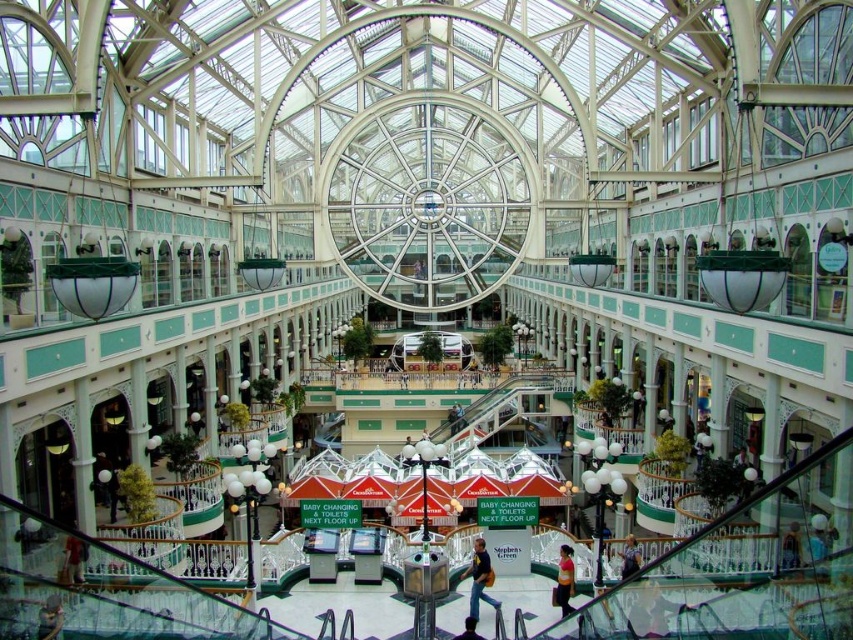
Who is taller, jeans at center or blue denim jeans at lower center?

jeans at center

Which is in front, point (476, 605) or point (630, 534)?

Point (476, 605) is in front.

Who is more distant from viewer, (479, 544) or (628, 557)?

Positioned behind is point (628, 557).

Locate an element on the screen. The height and width of the screenshot is (640, 853). jeans at center is located at coordinates (479, 579).

Is point (569, 588) positioned behind point (631, 536)?

No.

You are a GUI agent. You are given a task and a screenshot of the screen. Output one action in this format:
    pyautogui.click(x=<x>, y=<y>)
    Task: Click on the matte pink shirt at center
    This screenshot has width=853, height=640.
    Given the screenshot: What is the action you would take?
    pyautogui.click(x=564, y=579)

Is jeans at center closer to the viewer compared to matte pink shirt at center?

Yes, it is in front of matte pink shirt at center.

Which is behind, point (477, 540) or point (567, 593)?

Positioned behind is point (477, 540).

What are the coordinates of `jeans at center` in the screenshot? It's located at (479, 579).

Image resolution: width=853 pixels, height=640 pixels. What are the coordinates of `jeans at center` in the screenshot? It's located at (479, 579).